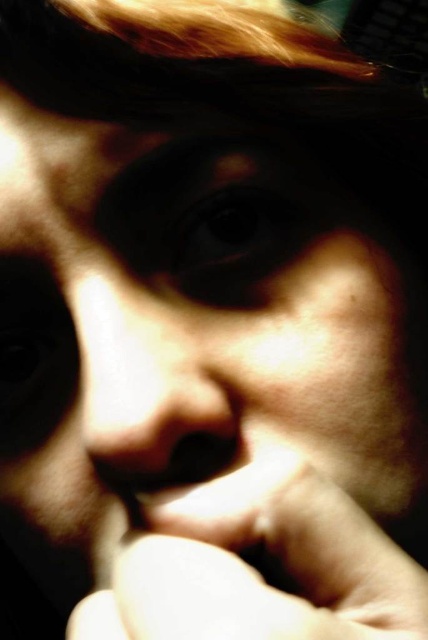
Question: Considering the relative positions of smooth skin hand at center and smooth skin nose at center in the image provided, where is smooth skin hand at center located with respect to smooth skin nose at center?

Choices:
 (A) right
 (B) left

Answer: (A)

Question: Observing the image, what is the correct spatial positioning of smooth skin hand at center in reference to smooth skin nose at center?

Choices:
 (A) below
 (B) above

Answer: (A)

Question: Among these objects, which one is nearest to the camera?

Choices:
 (A) smooth skin nose at center
 (B) smooth skin hand at center

Answer: (B)

Question: Can you confirm if smooth skin hand at center is positioned above smooth skin nose at center?

Choices:
 (A) no
 (B) yes

Answer: (A)